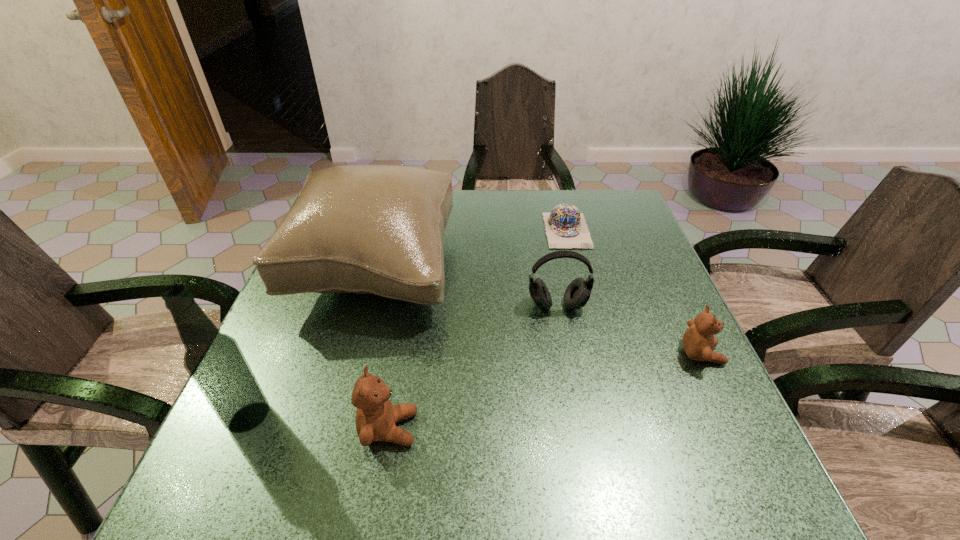
Please point a space for a new teddy_bear to maintain equal intervals. Please provide its 2D coordinates. Your answer should be formatted as a tuple, i.e. [(x, y)], where the tuple contains the x and y coordinates of a point satisfying the conditions above.

[(557, 389)]